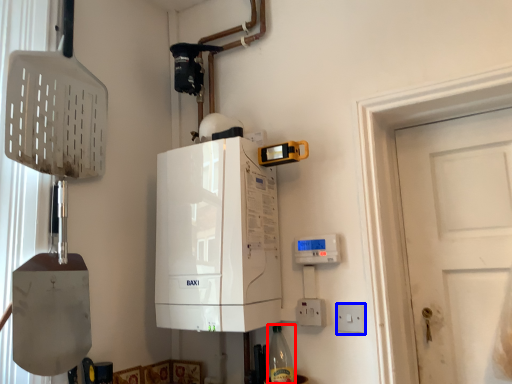
Question: Among these objects, which one is farthest to the camera, bottle (highlighted by a red box) or electric outlet (highlighted by a blue box)?

Choices:
 (A) bottle
 (B) electric outlet

Answer: (A)